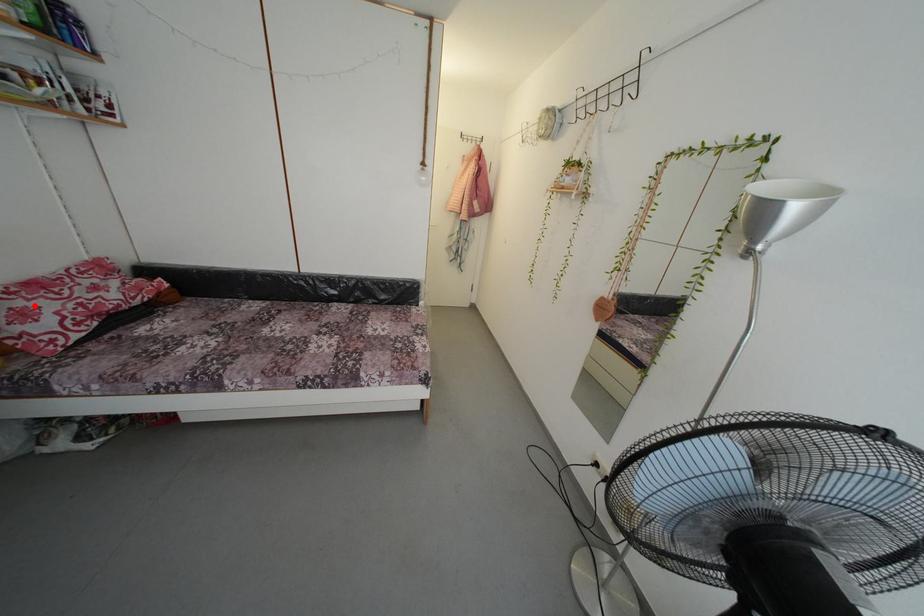
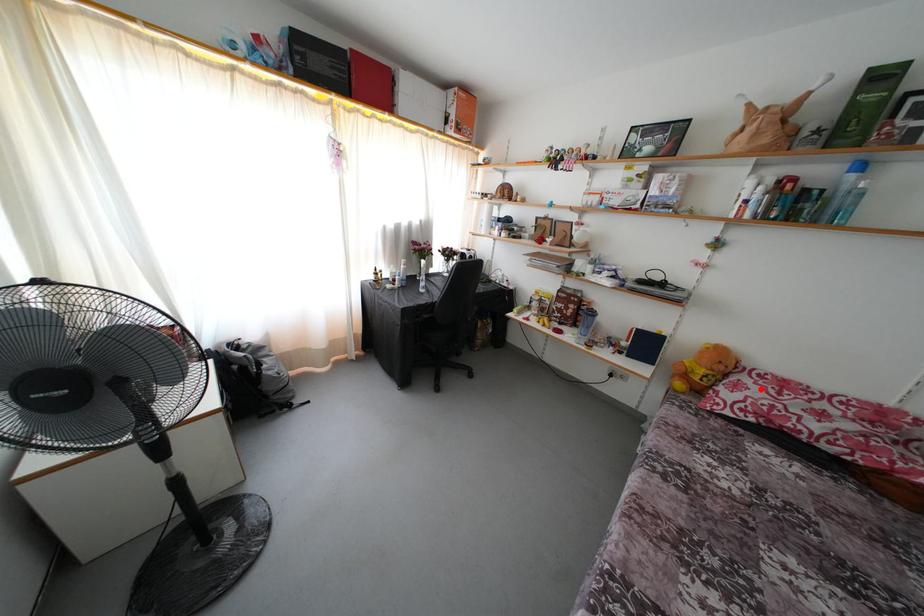
I am providing you with two images of the same scene from different viewpoints. A red point is marked on the first image and another point is marked on the second image. Is the red point in image1 aligned with the point shown in image2?

Yes